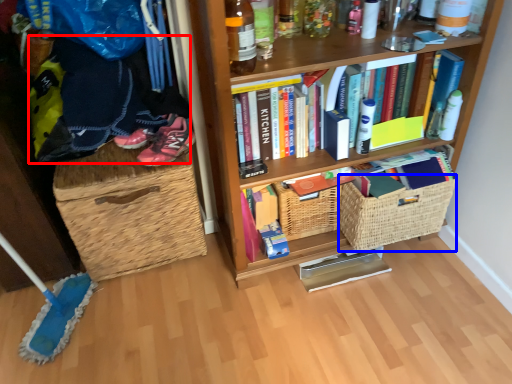
Question: Which of the following is the closest to the observer, clothing (highlighted by a red box) or basket (highlighted by a blue box)?

Choices:
 (A) clothing
 (B) basket

Answer: (A)